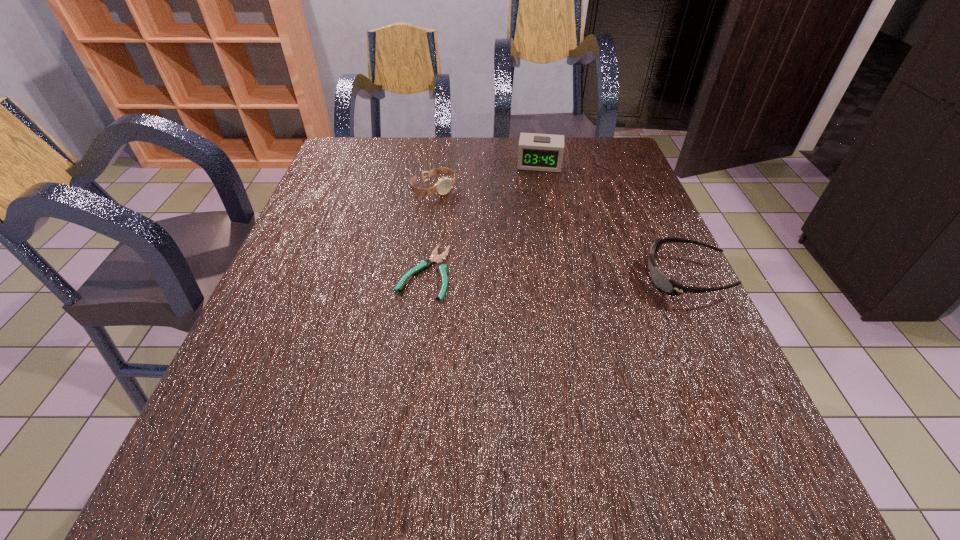
Where is `the shortest object`? The image size is (960, 540). the shortest object is located at coordinates (435, 258).

Where is `the rightmost object`? This screenshot has height=540, width=960. the rightmost object is located at coordinates [668, 286].

Locate an element on the screen. This screenshot has width=960, height=540. the third object from left to right is located at coordinates (538, 152).

Locate an element on the screen. The width and height of the screenshot is (960, 540). alarm clock is located at coordinates (538, 152).

This screenshot has height=540, width=960. What are the coordinates of `the third nearest object` in the screenshot? It's located at (443, 186).

At what (x,y) coordinates should I click in order to perform the action: click on vacant region located on the right of the pliers. Please return your answer as a coordinate pair (x, y). The width and height of the screenshot is (960, 540). Looking at the image, I should click on (513, 272).

Identify the location of free space located on the lenses of the sunglasses. (621, 277).

Find the location of a particular element. The image size is (960, 540). free space located on the lenses of the sunglasses is located at coordinates (489, 277).

At what (x,y) coordinates should I click in order to perform the action: click on vacant area located 0.090m on the lenses of the sunglasses. Please return your answer as a coordinate pair (x, y). Looking at the image, I should click on (603, 277).

Locate an element on the screen. The width and height of the screenshot is (960, 540). blank area located 0.360m on the front-facing side of the second object from right to left is located at coordinates (531, 254).